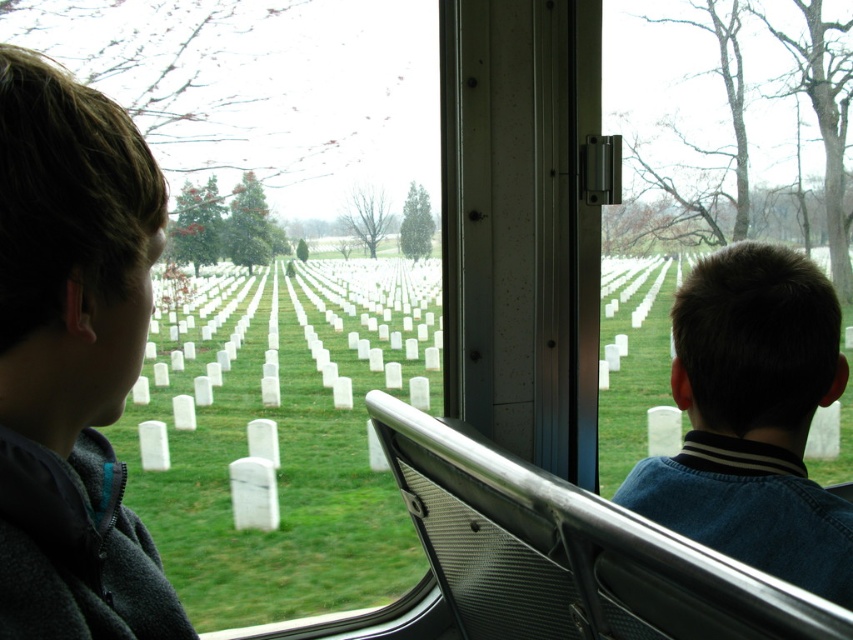
Question: Which object is farther from the camera taking this photo?

Choices:
 (A) dark blue sweater at center
 (B) dark brown hair at left
 (C) clear glass window at center

Answer: (C)

Question: Which object is the closest to the clear glass window at center?

Choices:
 (A) dark brown hair at left
 (B) dark blue sweater at center

Answer: (B)

Question: Which of the following is the closest to the observer?

Choices:
 (A) dark blue sweater at center
 (B) dark brown hair at left

Answer: (B)

Question: Does dark brown hair at left have a larger size compared to dark blue sweater at center?

Choices:
 (A) no
 (B) yes

Answer: (A)

Question: Does dark blue sweater at center come in front of clear glass window at center?

Choices:
 (A) no
 (B) yes

Answer: (B)

Question: Does dark blue sweater at center appear under clear glass window at center?

Choices:
 (A) yes
 (B) no

Answer: (A)